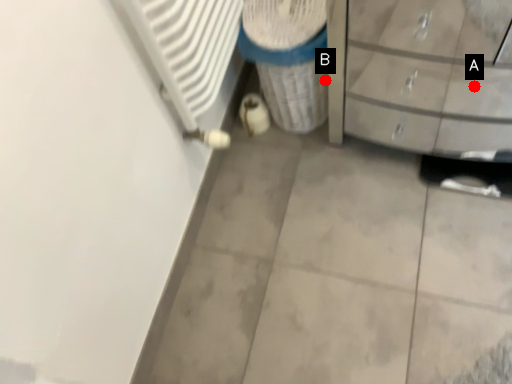
Question: Two points are circled on the image, labeled by A and B beside each circle. Which point is closer to the camera?

Choices:
 (A) A is closer
 (B) B is closer

Answer: (B)